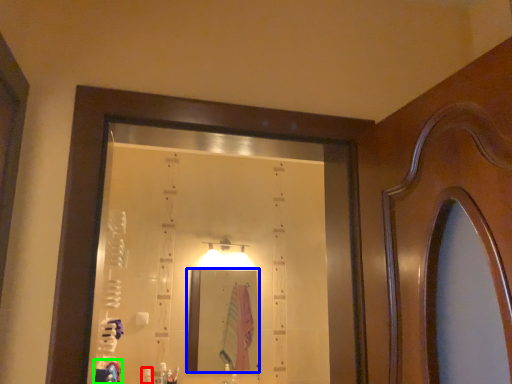
Question: Based on their relative distances, which object is nearer to toiletry (highlighted by a red box)? Choose from mirror (highlighted by a blue box) and robe (highlighted by a green box).

Choices:
 (A) mirror
 (B) robe

Answer: (B)